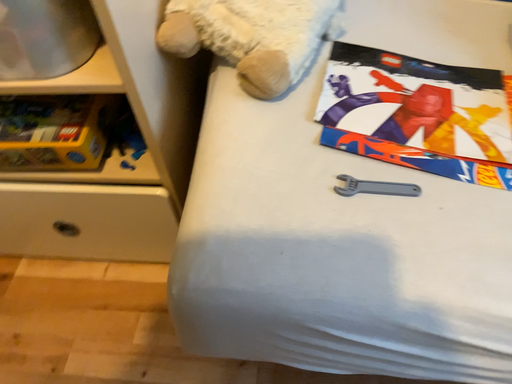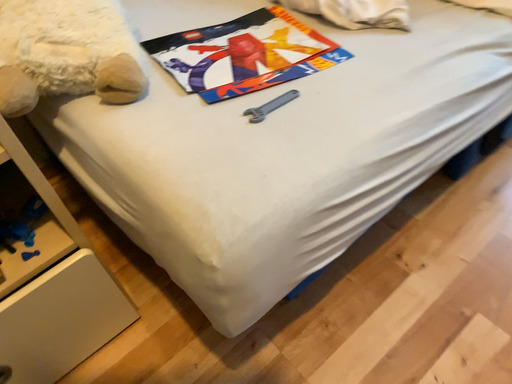
Question: Which way did the camera rotate in the video?

Choices:
 (A) rotated downward
 (B) rotated upward

Answer: (B)